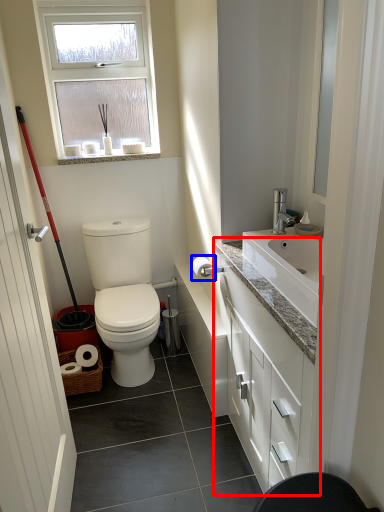
Question: Among these objects, which one is farthest to the camera, bathroom cabinet (highlighted by a red box) or toilet paper (highlighted by a blue box)?

Choices:
 (A) bathroom cabinet
 (B) toilet paper

Answer: (B)